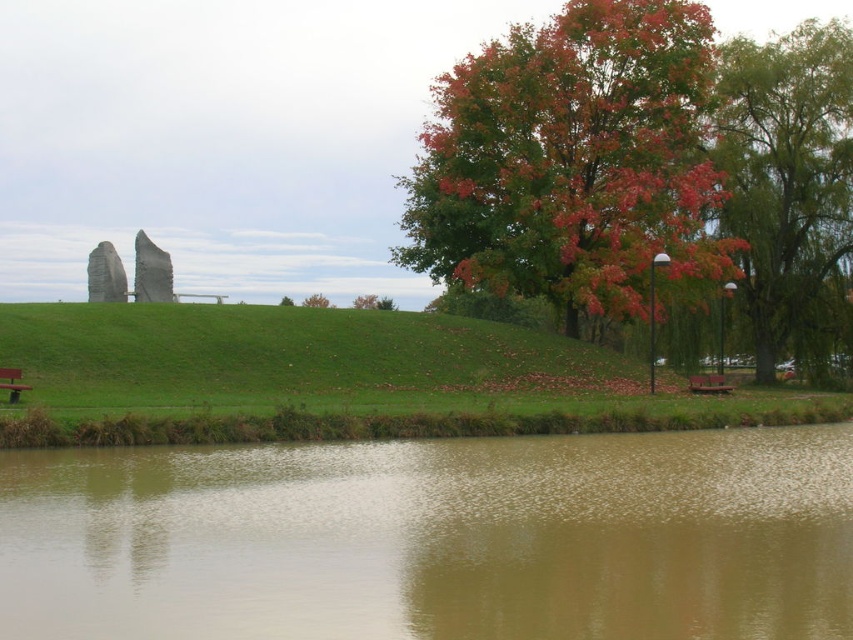
Question: Does autumn leaves tree at right come behind green matte tree at center?

Choices:
 (A) yes
 (B) no

Answer: (B)

Question: Which of the following is the closest to the observer?

Choices:
 (A) wooden park bench at lower right
 (B) brown muddy water at lower center

Answer: (B)

Question: Can you confirm if wooden park bench at lower left is smaller than green matte tree at center?

Choices:
 (A) no
 (B) yes

Answer: (B)

Question: Estimate the real-world distances between objects in this image. Which object is closer to the brown muddy water at lower center?

Choices:
 (A) green matte tree at center
 (B) wooden park bench at lower right

Answer: (B)

Question: Which is nearer to the green matte tree at center?

Choices:
 (A) brown muddy water at lower center
 (B) wooden park bench at lower right
 (C) green leafy tree at upper right
 (D) autumn leaves tree at right

Answer: (D)

Question: Does wooden park bench at lower right appear under wooden park bench at lower left?

Choices:
 (A) no
 (B) yes

Answer: (B)